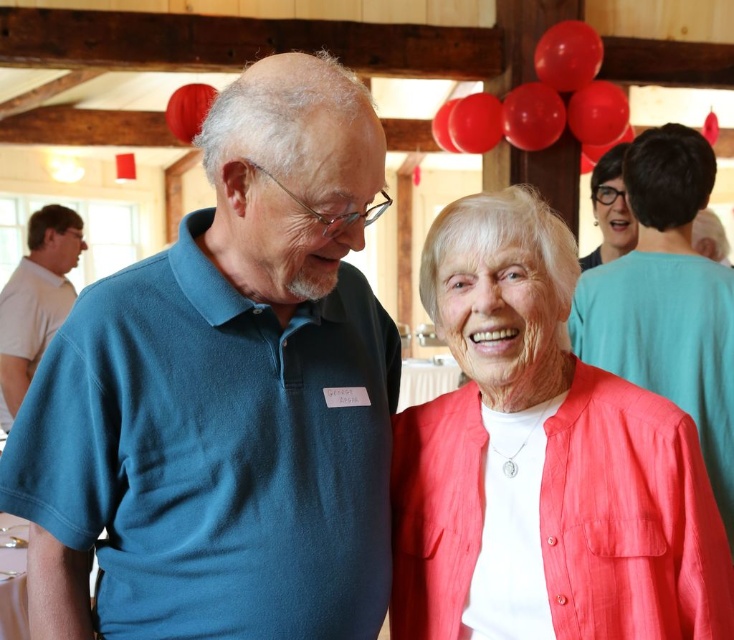
Question: Can you confirm if matte coral blouse at center is positioned to the right of matte black glasses at upper right?

Choices:
 (A) no
 (B) yes

Answer: (A)

Question: Does blue cotton polo shirt at left have a greater width compared to matte black glasses at upper right?

Choices:
 (A) yes
 (B) no

Answer: (A)

Question: Which object is closer to the camera taking this photo?

Choices:
 (A) white cotton shirt at left
 (B) matte coral blouse at center
 (C) matte black glasses at upper right

Answer: (B)

Question: Which of these objects is positioned closest to the matte coral blouse at center?

Choices:
 (A) blue cotton polo shirt at left
 (B) matte black glasses at upper right
 (C) white cotton shirt at left

Answer: (A)

Question: Which object appears closest to the camera in this image?

Choices:
 (A) matte coral blouse at center
 (B) matte black glasses at upper right

Answer: (A)

Question: Can you confirm if matte coral blouse at center is wider than matte black glasses at upper right?

Choices:
 (A) yes
 (B) no

Answer: (A)